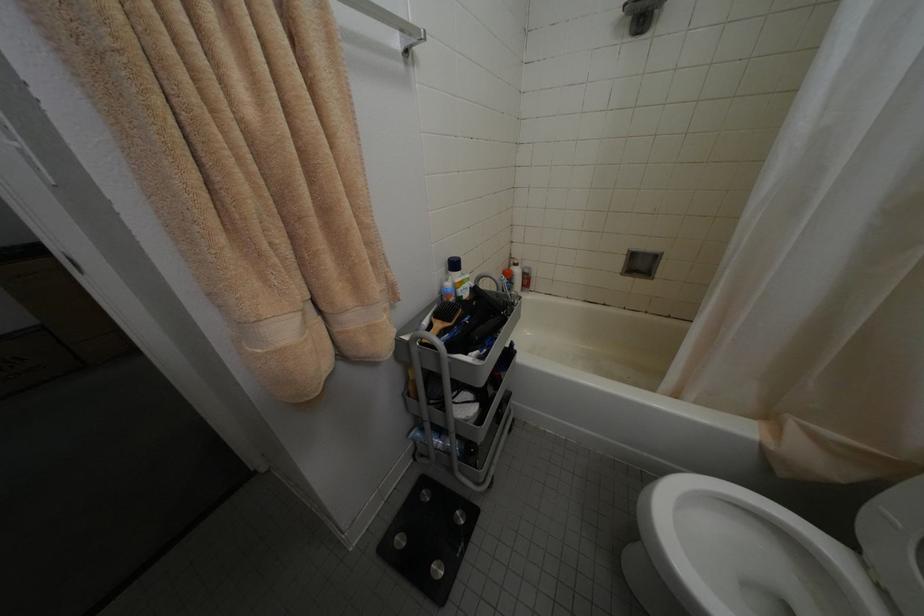
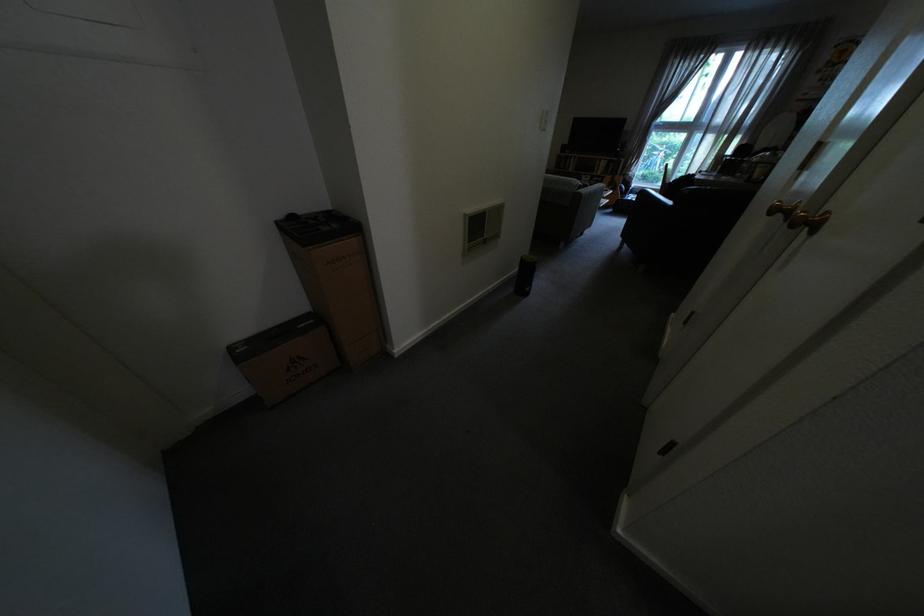
Question: In a continuous first-person perspective shot, in which direction is the camera moving?

Choices:
 (A) Left
 (B) Right
 (C) Forward
 (D) Backward

Answer: (A)